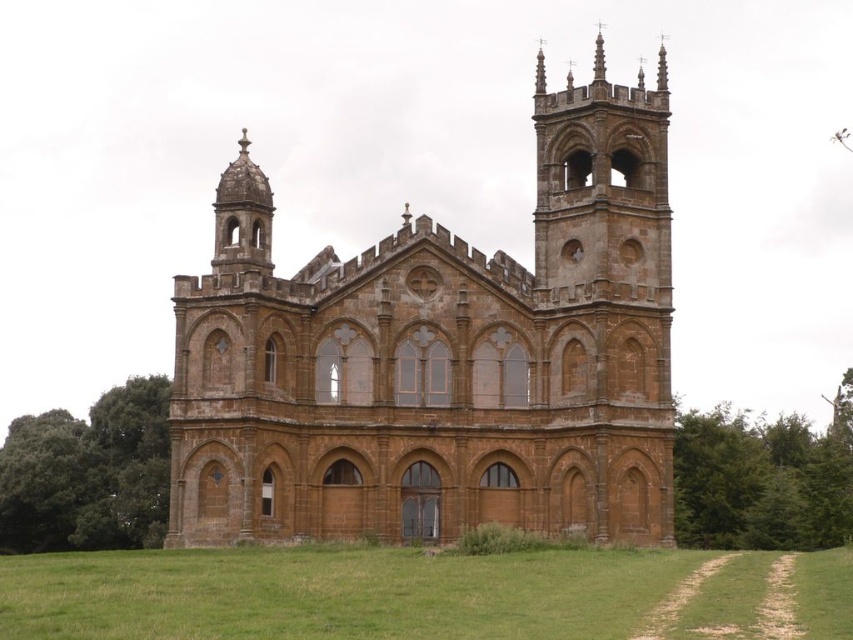
Question: Does brown stone church at center appear on the right side of green grass at lower center?

Choices:
 (A) yes
 (B) no

Answer: (A)

Question: Does brown stone church at center have a lesser width compared to green grass at lower center?

Choices:
 (A) no
 (B) yes

Answer: (B)

Question: Which of the following is the closest to the observer?

Choices:
 (A) (335, 556)
 (B) (668, 404)

Answer: (A)

Question: Is brown stone church at center positioned at the back of green grass at lower center?

Choices:
 (A) yes
 (B) no

Answer: (A)

Question: Among these points, which one is nearest to the camera?

Choices:
 (A) (346, 614)
 (B) (426, 269)

Answer: (A)

Question: Which of the following is the closest to the observer?

Choices:
 (A) green grass at lower center
 (B) brown stone church at center

Answer: (A)